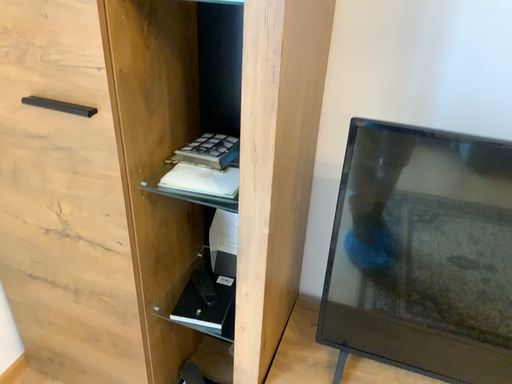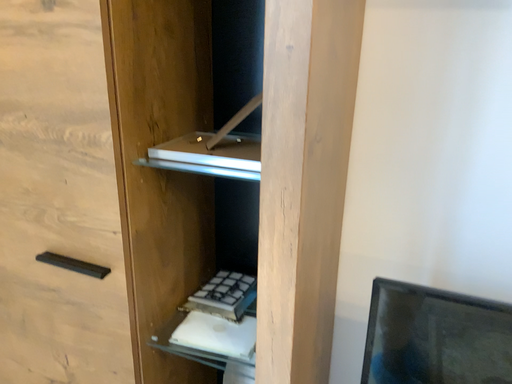
Question: How did the camera likely rotate when shooting the video?

Choices:
 (A) rotated upward
 (B) rotated downward

Answer: (A)